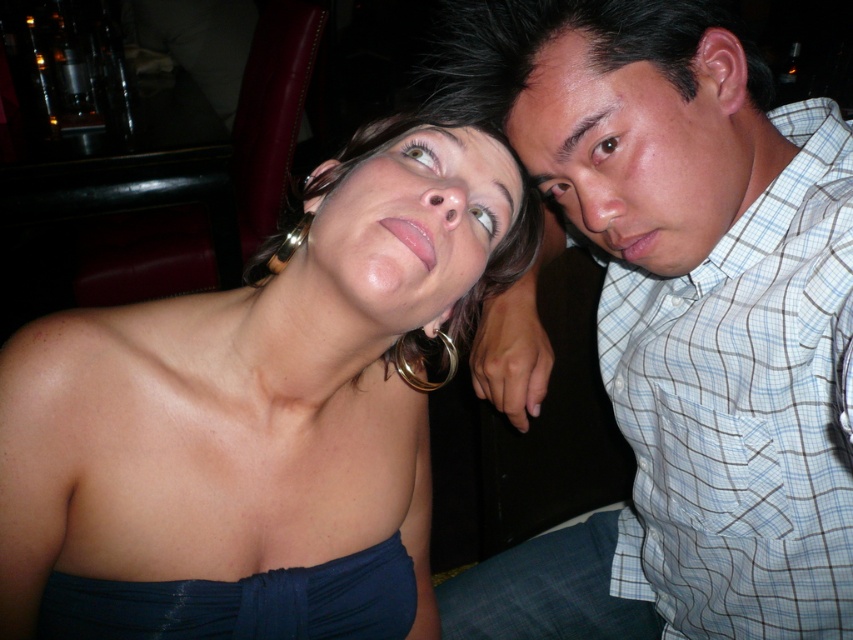
You are planning to buy a new outfit and want to match it with either the shiny blue dress at center or the blue plaid shirt at upper right. Based on their sizes, which one would you choose if you prefer a wider silhouette?

The shiny blue dress at center has a larger width than the blue plaid shirt at upper right, so if you prefer a wider silhouette, you should choose the shiny blue dress at center.

You are a photographer trying to capture a candid shot of the two people in the scene. You notice the blue plaid shirt at upper right and the matte skin face at upper center. Which object is positioned to the right side of the other?

The blue plaid shirt at upper right is to the right of the matte skin face at upper center.